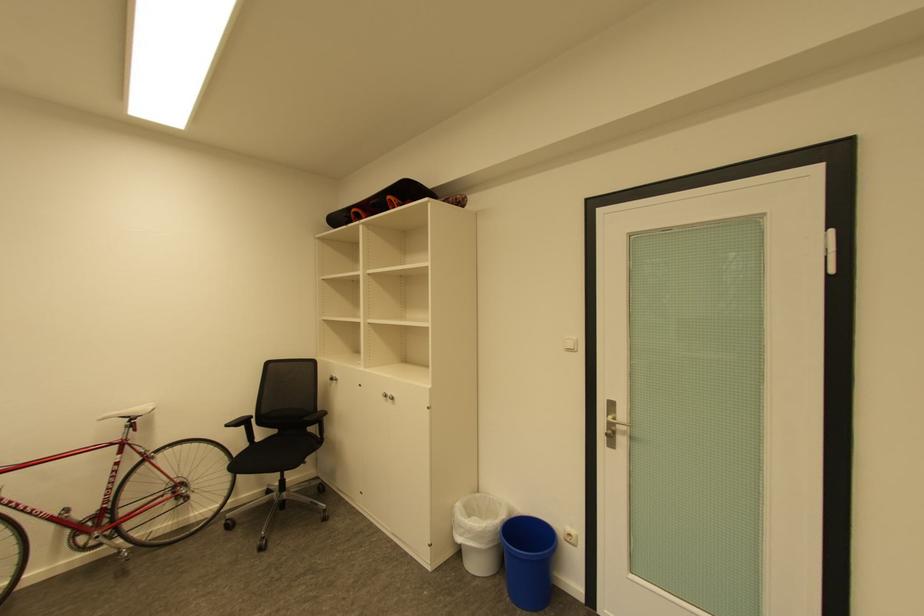
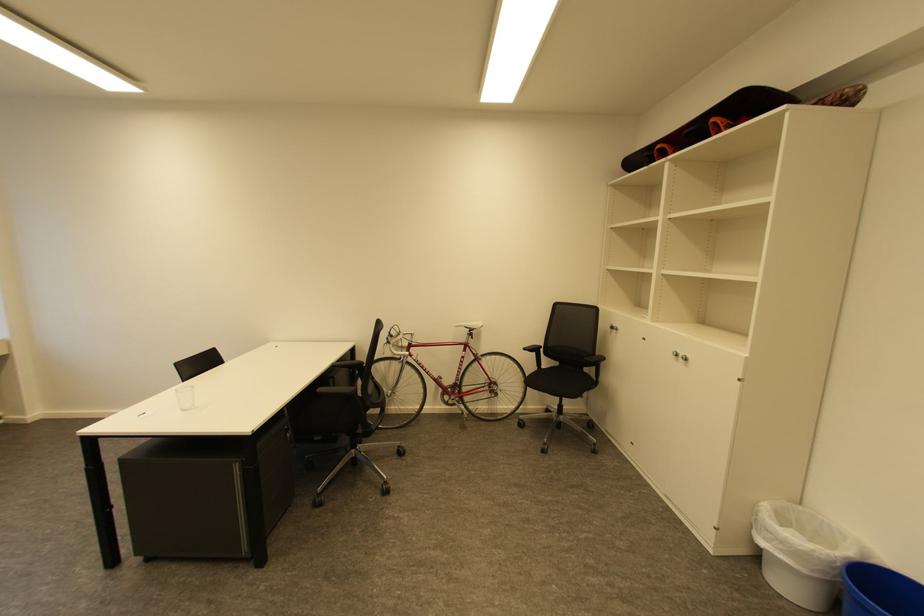
Find the pixel in the second image that matches (x=468, y=528) in the first image.

(775, 533)